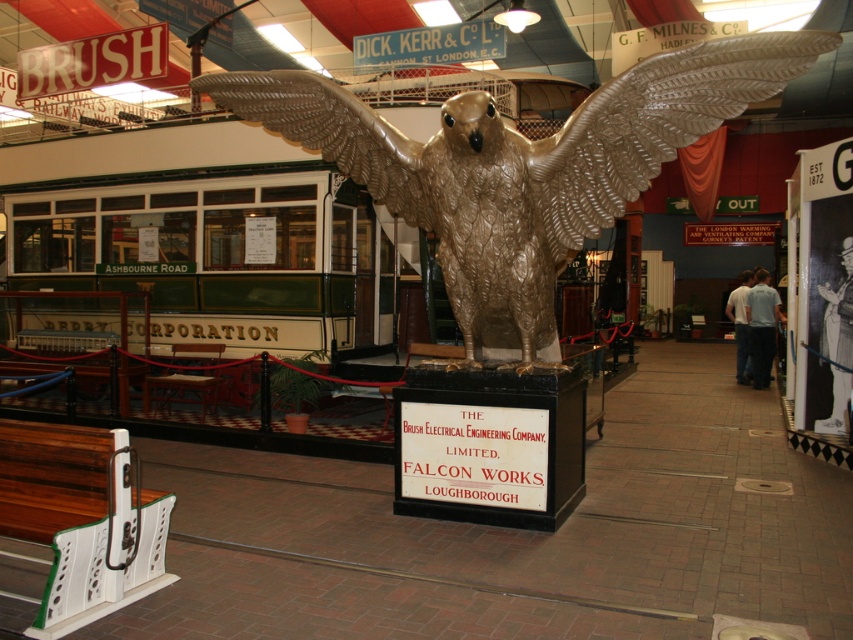
Which is more to the right, gold metallic eagle at center or metallic gold wing at center?

Positioned to the right is gold metallic eagle at center.

Which of these two, gold metallic eagle at center or metallic gold wing at center, stands shorter?

Standing shorter between the two is metallic gold wing at center.

At what (x,y) coordinates should I click in order to perform the action: click on gold metallic eagle at center. Please return your answer as a coordinate pair (x, y). Looking at the image, I should click on (521, 168).

Find the location of a particular element. gold metallic eagle at center is located at coordinates (521, 168).

Is gold metallic eagle at center behind gold metallic wing at upper center?

Yes, it is behind gold metallic wing at upper center.

Does gold metallic eagle at center appear over gold metallic wing at upper center?

Actually, gold metallic eagle at center is below gold metallic wing at upper center.

Does point (556, 243) lie behind point (604, 122)?

Yes, point (556, 243) is behind point (604, 122).

The image size is (853, 640). Find the location of `gold metallic eagle at center`. gold metallic eagle at center is located at coordinates (521, 168).

Looking at this image, can you confirm if gold metallic wing at upper center is bigger than metallic gold wing at center?

Actually, gold metallic wing at upper center might be smaller than metallic gold wing at center.

Can you confirm if gold metallic wing at upper center is positioned to the left of metallic gold wing at center?

No, gold metallic wing at upper center is not to the left of metallic gold wing at center.

Identify the location of gold metallic wing at upper center. The image size is (853, 640). (654, 124).